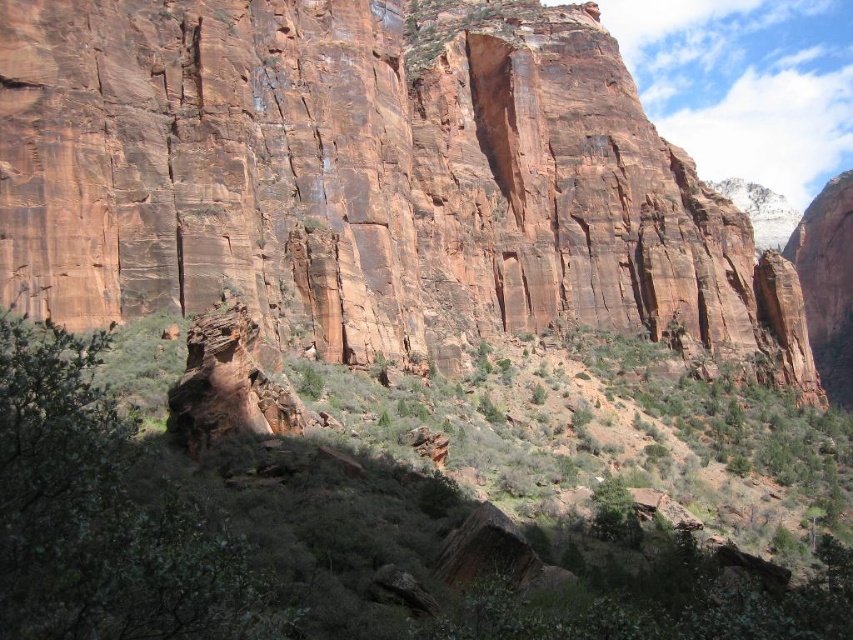
Can you confirm if reddish-brown rock face at center is shorter than green leafy shrubs at center?

No, reddish-brown rock face at center is not shorter than green leafy shrubs at center.

The image size is (853, 640). Identify the location of reddish-brown rock face at center. (350, 172).